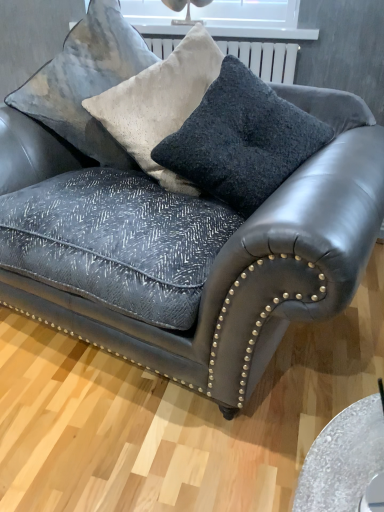
What is the approximate height of velvet textured pillow at upper center, placed as the second throw pillow when sorted from right to left?

It is 21.19 inches.

You are a GUI agent. You are given a task and a screenshot of the screen. Output one action in this format:
    pyautogui.click(x=<x>, y=<y>)
    Task: Click on the dark gray textured cushion at center, arranged as the 2th throw pillow when viewed from the left
    
    Given the screenshot: What is the action you would take?
    pyautogui.click(x=241, y=140)

Locate an element on the screen. Image resolution: width=384 pixels, height=512 pixels. pillow above the velvet textured pillow at upper center, the first throw pillow from the left (from the image's perspective) is located at coordinates (86, 81).

Looking at this image, could you tell me if velvet cushion at upper center is facing velvet textured pillow at upper center, placed as the second throw pillow when sorted from right to left?

No.

From a real-world perspective, is velvet cushion at upper center over velvet textured pillow at upper center, placed as the second throw pillow when sorted from right to left?

Correct, in the physical world, velvet cushion at upper center is higher than velvet textured pillow at upper center, placed as the second throw pillow when sorted from right to left.

Which is correct: velvet cushion at upper center is inside velvet textured pillow at upper center, the first throw pillow from the left, or outside of it?

velvet cushion at upper center exists entirely within velvet textured pillow at upper center, the first throw pillow from the left.

Is velvet textured pillow at upper center, the first throw pillow from the left, directly adjacent to velvet cushion at upper center?

velvet textured pillow at upper center, the first throw pillow from the left, and velvet cushion at upper center are not in contact.

Considering the positions of objects velvet textured pillow at upper center, the first throw pillow from the left, and velvet cushion at upper center in the image provided, who is more to the left, velvet textured pillow at upper center, the first throw pillow from the left, or velvet cushion at upper center?

Positioned to the left is velvet cushion at upper center.

Which of these two, velvet textured pillow at upper center, the first throw pillow from the left, or velvet cushion at upper center, is wider?

velvet textured pillow at upper center, the first throw pillow from the left, is wider.

How much distance is there between velvet textured pillow at upper center, placed as the second throw pillow when sorted from right to left, and velvet cushion at upper center?

velvet textured pillow at upper center, placed as the second throw pillow when sorted from right to left, is 6.20 inches away from velvet cushion at upper center.

Which of these two, dark gray textured cushion at center, arranged as the 2th throw pillow when viewed from the left, or velvet cushion at upper center, is bigger?

velvet cushion at upper center is bigger.

From the image's perspective, which one is positioned lower, dark gray textured cushion at center, arranged as the 2th throw pillow when viewed from the left, or velvet cushion at upper center?

dark gray textured cushion at center, arranged as the 2th throw pillow when viewed from the left, from the image's perspective.

Which of these two, dark gray textured cushion at center, the first throw pillow in the right-to-left sequence, or velvet cushion at upper center, is wider?

Wider between the two is velvet cushion at upper center.

Looking at this image, between velvet textured pillow at upper center, placed as the second throw pillow when sorted from right to left, and dark gray textured cushion at center, arranged as the 2th throw pillow when viewed from the left, which one appears on the left side from the viewer's perspective?

Positioned to the left is velvet textured pillow at upper center, placed as the second throw pillow when sorted from right to left.

Is velvet textured pillow at upper center, placed as the second throw pillow when sorted from right to left, oriented away from dark gray textured cushion at center, arranged as the 2th throw pillow when viewed from the left?

That's not correct — velvet textured pillow at upper center, placed as the second throw pillow when sorted from right to left, is not looking away from dark gray textured cushion at center, arranged as the 2th throw pillow when viewed from the left.

Is velvet textured pillow at upper center, the first throw pillow from the left, far away from dark gray textured cushion at center, the first throw pillow in the right-to-left sequence?

No.

Does point (235, 179) lie in front of point (181, 42)?

Yes, point (235, 179) is closer to viewer.

From the image's perspective, is dark gray textured cushion at center, arranged as the 2th throw pillow when viewed from the left, under velvet textured pillow at upper center, the first throw pillow from the left?

Indeed, from the image's perspective, dark gray textured cushion at center, arranged as the 2th throw pillow when viewed from the left, is shown beneath velvet textured pillow at upper center, the first throw pillow from the left.

Is dark gray textured cushion at center, arranged as the 2th throw pillow when viewed from the left, next to velvet textured pillow at upper center, the first throw pillow from the left, and touching it?

No, dark gray textured cushion at center, arranged as the 2th throw pillow when viewed from the left, is not with velvet textured pillow at upper center, the first throw pillow from the left.

Is dark gray textured cushion at center, arranged as the 2th throw pillow when viewed from the left, spatially inside velvet textured pillow at upper center, the first throw pillow from the left, or outside of it?

dark gray textured cushion at center, arranged as the 2th throw pillow when viewed from the left, is contained in velvet textured pillow at upper center, the first throw pillow from the left.

Which object is further away from the camera, velvet cushion at upper center or dark gray textured cushion at center, arranged as the 2th throw pillow when viewed from the left?

velvet cushion at upper center.

From a real-world perspective, is velvet cushion at upper center positioned above or below dark gray textured cushion at center, the first throw pillow in the right-to-left sequence?

velvet cushion at upper center is above dark gray textured cushion at center, the first throw pillow in the right-to-left sequence.

Which point is more forward, (124, 76) or (211, 181)?

The point (211, 181) is closer.

From the image's perspective, which is below, velvet cushion at upper center or dark gray textured cushion at center, arranged as the 2th throw pillow when viewed from the left?

dark gray textured cushion at center, arranged as the 2th throw pillow when viewed from the left, from the image's perspective.

At what (x,y) coordinates should I click in order to perform the action: click on throw pillow that is the 1st object directly below the velvet cushion at upper center (from a real-world perspective). Please return your answer as a coordinate pair (x, y). This screenshot has width=384, height=512. Looking at the image, I should click on [159, 103].

Find the location of a particular element. The width and height of the screenshot is (384, 512). pillow on the left of velvet textured pillow at upper center, placed as the second throw pillow when sorted from right to left is located at coordinates (86, 81).

Looking at the image, which one is located closer to dark gray textured cushion at center, arranged as the 2th throw pillow when viewed from the left, velvet textured pillow at upper center, placed as the second throw pillow when sorted from right to left, or velvet cushion at upper center?

The object closer to dark gray textured cushion at center, arranged as the 2th throw pillow when viewed from the left, is velvet textured pillow at upper center, placed as the second throw pillow when sorted from right to left.

From the image, which object appears to be nearer to dark gray textured cushion at center, the first throw pillow in the right-to-left sequence, velvet cushion at upper center or velvet textured pillow at upper center, placed as the second throw pillow when sorted from right to left?

velvet textured pillow at upper center, placed as the second throw pillow when sorted from right to left, is closer to dark gray textured cushion at center, the first throw pillow in the right-to-left sequence.

Based on their spatial positions, is dark gray textured cushion at center, arranged as the 2th throw pillow when viewed from the left, or velvet textured pillow at upper center, placed as the second throw pillow when sorted from right to left, closer to velvet cushion at upper center?

Based on the image, velvet textured pillow at upper center, placed as the second throw pillow when sorted from right to left, appears to be nearer to velvet cushion at upper center.

Based on their spatial positions, is velvet cushion at upper center or dark gray textured cushion at center, arranged as the 2th throw pillow when viewed from the left, further from velvet textured pillow at upper center, placed as the second throw pillow when sorted from right to left?

dark gray textured cushion at center, arranged as the 2th throw pillow when viewed from the left.

Which object lies further to the anchor point velvet cushion at upper center, velvet textured pillow at upper center, the first throw pillow from the left, or dark gray textured cushion at center, arranged as the 2th throw pillow when viewed from the left?

Among the two, dark gray textured cushion at center, arranged as the 2th throw pillow when viewed from the left, is located further to velvet cushion at upper center.

Considering their positions, is dark gray textured cushion at center, arranged as the 2th throw pillow when viewed from the left, positioned further to velvet textured pillow at upper center, the first throw pillow from the left, than velvet cushion at upper center?

dark gray textured cushion at center, arranged as the 2th throw pillow when viewed from the left, lies further to velvet textured pillow at upper center, the first throw pillow from the left, than the other object.

Locate an element on the screen. This screenshot has width=384, height=512. throw pillow located between velvet cushion at upper center and dark gray textured cushion at center, arranged as the 2th throw pillow when viewed from the left, in the left-right direction is located at coordinates (x=159, y=103).